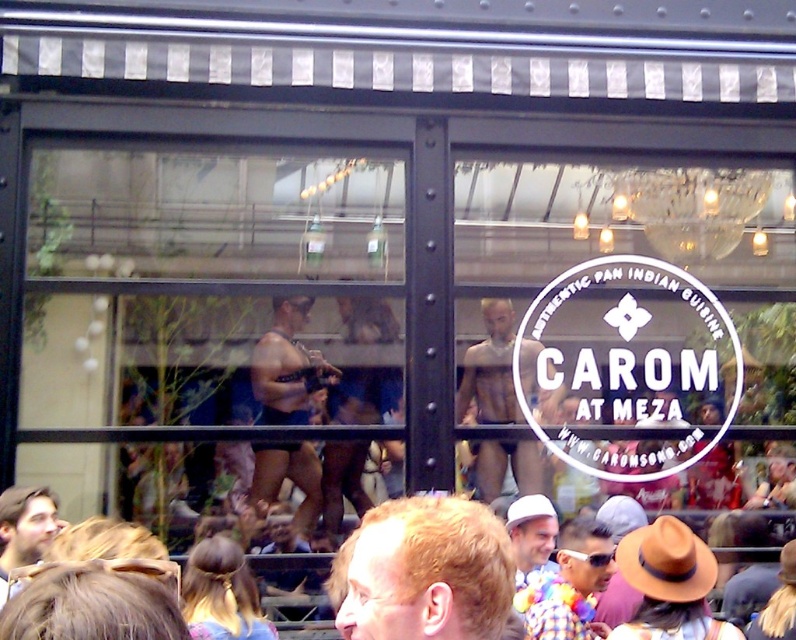
Question: Which object is the closest to the smooth skin torso at center?

Choices:
 (A) smooth black shorts at center
 (B) light brown hair at center

Answer: (A)

Question: Is light brown hair at center to the left of smooth black shorts at center from the viewer's perspective?

Choices:
 (A) yes
 (B) no

Answer: (B)

Question: Considering the relative positions of light brown hair at center and smooth black shorts at center in the image provided, where is light brown hair at center located with respect to smooth black shorts at center?

Choices:
 (A) below
 (B) above

Answer: (A)

Question: Can you confirm if smooth skin torso at center is positioned to the left of brown felt hat at lower right?

Choices:
 (A) yes
 (B) no

Answer: (B)

Question: Which of the following is the closest to the observer?

Choices:
 (A) click(x=674, y=557)
 (B) click(x=193, y=634)
 (C) click(x=259, y=364)
 (D) click(x=281, y=381)

Answer: (A)

Question: Which object appears closest to the camera in this image?

Choices:
 (A) brown felt hat at lower right
 (B) smooth skin torso at center
 (C) light brown hair at center
 (D) transparent glass door at upper left

Answer: (C)